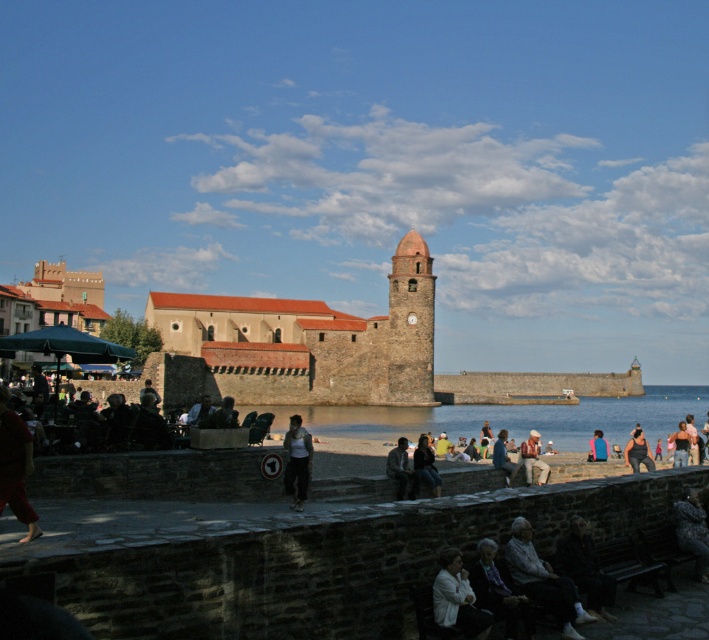
Consider the image. Can you confirm if barefoot person at lower left is thinner than white matte jacket at lower center?

No, barefoot person at lower left is not thinner than white matte jacket at lower center.

Is barefoot person at lower left in front of white matte jacket at lower center?

No, it is not.

Between point (28, 506) and point (450, 588), which one is positioned in front?

Point (450, 588) is in front.

Locate an element on the screen. The height and width of the screenshot is (640, 709). barefoot person at lower left is located at coordinates (16, 467).

Between point (527, 570) and point (679, 429), which one is positioned behind?

Positioned behind is point (679, 429).

Describe the element at coordinates (542, 580) in the screenshot. I see `white fabric jacket at lower center` at that location.

Is point (563, 580) farther from camera compared to point (671, 435)?

No, (563, 580) is in front of (671, 435).

You are a GUI agent. You are given a task and a screenshot of the screen. Output one action in this format:
    pyautogui.click(x=<x>, y=<y>)
    Task: Click on the white fabric jacket at lower center
    
    Given the screenshot: What is the action you would take?
    pyautogui.click(x=542, y=580)

Is dark blue jeans at lower right bigger than light brown leather jacket at center?

No.

This screenshot has height=640, width=709. Describe the element at coordinates (637, 451) in the screenshot. I see `dark blue jeans at lower right` at that location.

At what (x,y) coordinates should I click in order to perform the action: click on dark blue jeans at lower right. Please return your answer as a coordinate pair (x, y). Looking at the image, I should click on (x=637, y=451).